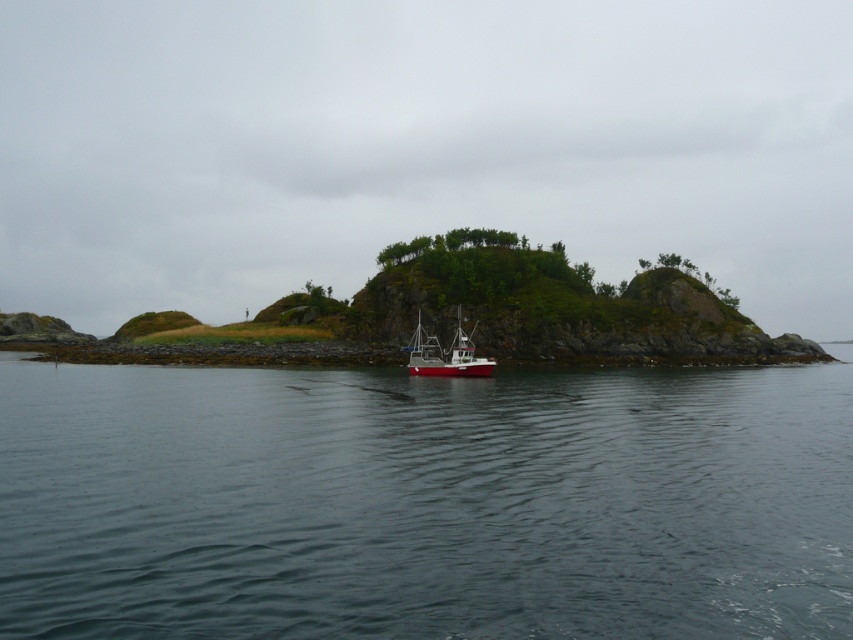
Is clear water at center smaller than red matte boat at center?

Actually, clear water at center might be larger than red matte boat at center.

Can you confirm if clear water at center is thinner than red matte boat at center?

No, clear water at center is not thinner than red matte boat at center.

Describe the element at coordinates (424, 502) in the screenshot. This screenshot has height=640, width=853. I see `clear water at center` at that location.

Image resolution: width=853 pixels, height=640 pixels. I want to click on clear water at center, so click(x=424, y=502).